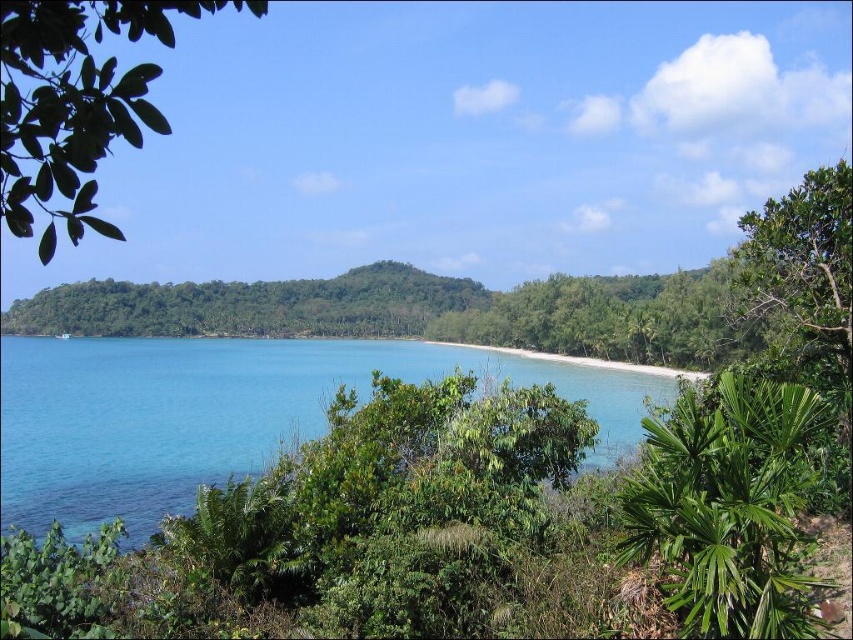
Is green leafy tree at upper right taller than white sand beach at center?

No, green leafy tree at upper right is not taller than white sand beach at center.

Looking at this image, who is lower down, green leafy tree at upper right or white sand beach at center?

white sand beach at center

Who is more forward, (849, 230) or (573, 358)?

Point (849, 230)

At what (x,y) coordinates should I click in order to perform the action: click on green leafy tree at upper right. Please return your answer as a coordinate pair (x, y). The width and height of the screenshot is (853, 640). Looking at the image, I should click on (801, 259).

Does green leafy tree at center appear on the right side of white sand beach at center?

Yes, green leafy tree at center is to the right of white sand beach at center.

This screenshot has width=853, height=640. What do you see at coordinates (616, 317) in the screenshot?
I see `green leafy tree at center` at bounding box center [616, 317].

Does point (445, 336) come farther from viewer compared to point (531, 352)?

Yes, it is behind point (531, 352).

Find the location of a particular element. The width and height of the screenshot is (853, 640). green leafy tree at center is located at coordinates (616, 317).

At what (x,y) coordinates should I click in order to perform the action: click on green leafy tree at upper left. Please return your answer as a coordinate pair (x, y). The height and width of the screenshot is (640, 853). Looking at the image, I should click on 74,102.

Does point (144, 67) come farther from viewer compared to point (637, 298)?

No.

Identify the location of green leafy tree at upper left. This screenshot has width=853, height=640. (74, 102).